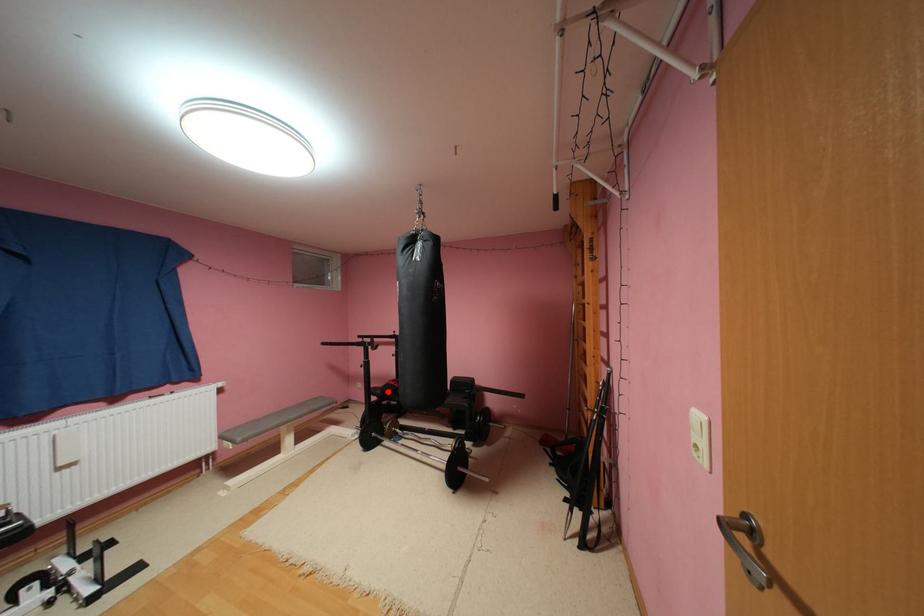
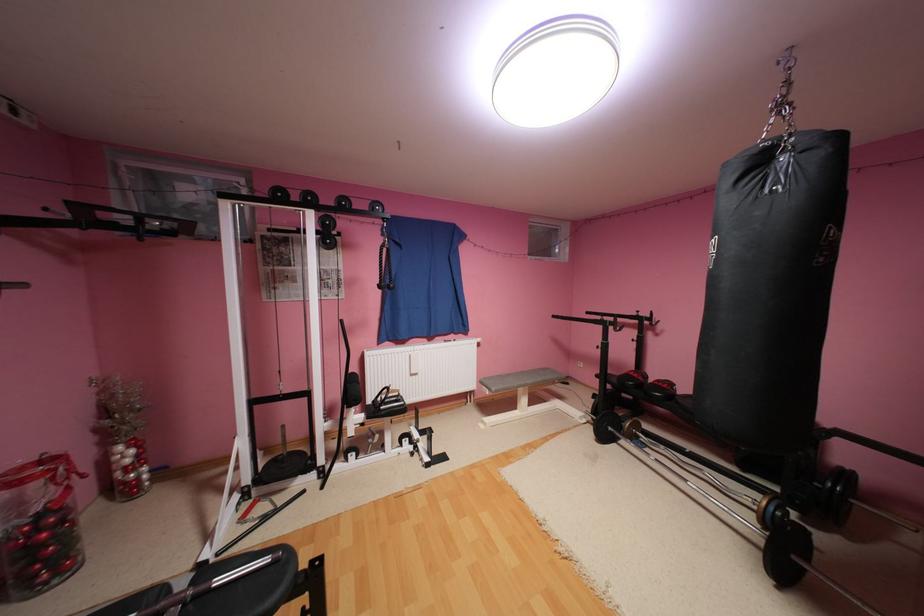
The point at the highlighted location is marked in the first image. Where is the corresponding point in the second image?

(624, 379)